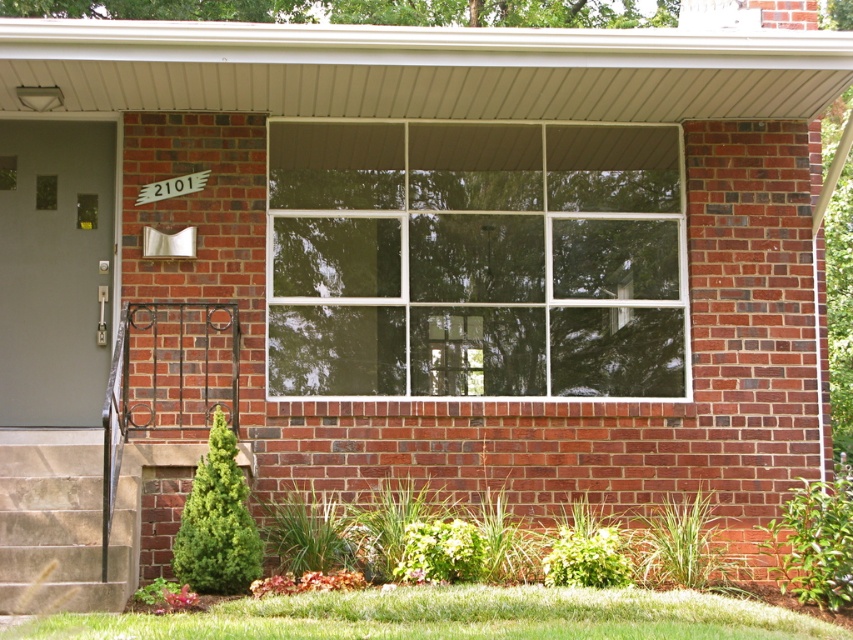
You are a delivery person trying to determine the best path to approach the house. You see the white glass window at center and the white plastic street sign at upper center. Which object is wider and could help you navigate closer to the entrance?

The white glass window at center might be wider than the white plastic street sign at upper center, so it could help you navigate closer to the entrance.

You are standing in front of the brick house and want to locate the white glass window at center. Based on the coordinates provided, can you determine its position relative to the front door and the wrought iron gate?

The white glass window at center is located at coordinates point (474, 259). Since the front door is to the left of the window and the wrought iron gate is near the bottom left corner, the window is positioned to the right of the front door and above the wrought iron gate.

You are standing in front of the house and want to enter. The white glass window at center and the stone stairs at lower left are in your view. Which object should you approach first to reach the entrance?

You should approach the stone stairs at lower left first because the white glass window at center is positioned to its right, meaning the stairs are closer to the entrance area.